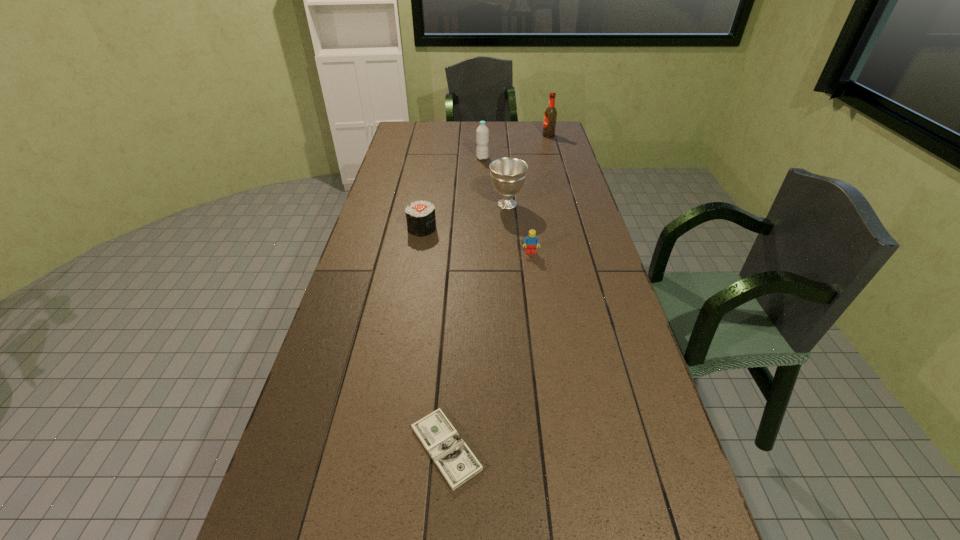
Where is `blank space at the left edge`? blank space at the left edge is located at coordinates point(382,211).

You are a GUI agent. You are given a task and a screenshot of the screen. Output one action in this format:
    pyautogui.click(x=<x>, y=<y>)
    Task: Click on the vacant space at the right edge of the desktop
    This screenshot has width=960, height=540.
    Given the screenshot: What is the action you would take?
    pyautogui.click(x=606, y=316)

Locate an element on the screen. Image resolution: width=960 pixels, height=540 pixels. vacant space at the far right corner of the desktop is located at coordinates (538, 131).

At what (x,y) coordinates should I click in order to perform the action: click on free space between the fifth farthest object and the shortest object. Please return your answer as a coordinate pair (x, y). Looking at the image, I should click on (489, 350).

Where is `empty location between the leftmost object and the beer bottle`? The width and height of the screenshot is (960, 540). empty location between the leftmost object and the beer bottle is located at coordinates (485, 182).

I want to click on free spot between the sushi and the shortest object, so click(434, 338).

At what (x,y) coordinates should I click in order to perform the action: click on vacant space that's between the farthest object and the sushi. Please return your answer as a coordinate pair (x, y). The image size is (960, 540). Looking at the image, I should click on (485, 182).

Locate an element on the screen. The height and width of the screenshot is (540, 960). free space between the leftmost object and the beer bottle is located at coordinates (485, 182).

What are the coordinates of `vacant point located between the water bottle and the leftmost object` in the screenshot? It's located at (452, 193).

This screenshot has width=960, height=540. Identify the location of vacant space that is in between the Lego and the fourth nearest object. (518, 228).